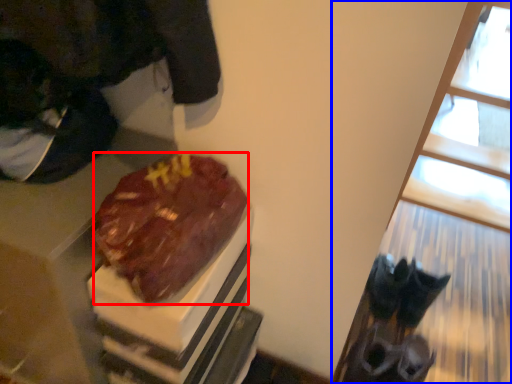
Question: Which object appears farthest to the camera in this image, chocolate cake (highlighted by a red box) or window (highlighted by a blue box)?

Choices:
 (A) chocolate cake
 (B) window

Answer: (A)